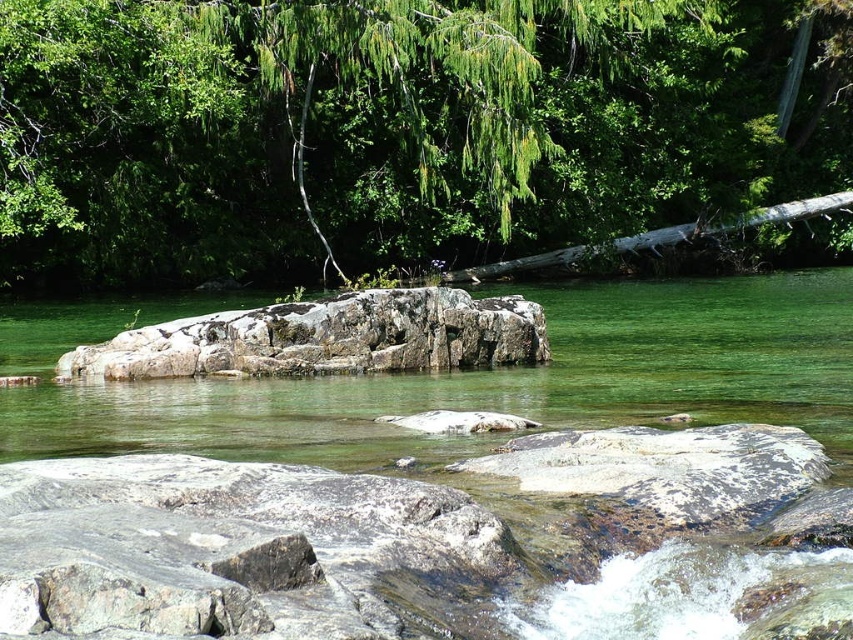
In the scene shown: You are standing at the edge of the river and see two points in the water. The first point is at coordinates point (764, 84) and the second is at point (376, 312). Which point is closer to you?

Point (764, 84) is closer to you because it is further to the viewer than point (376, 312).